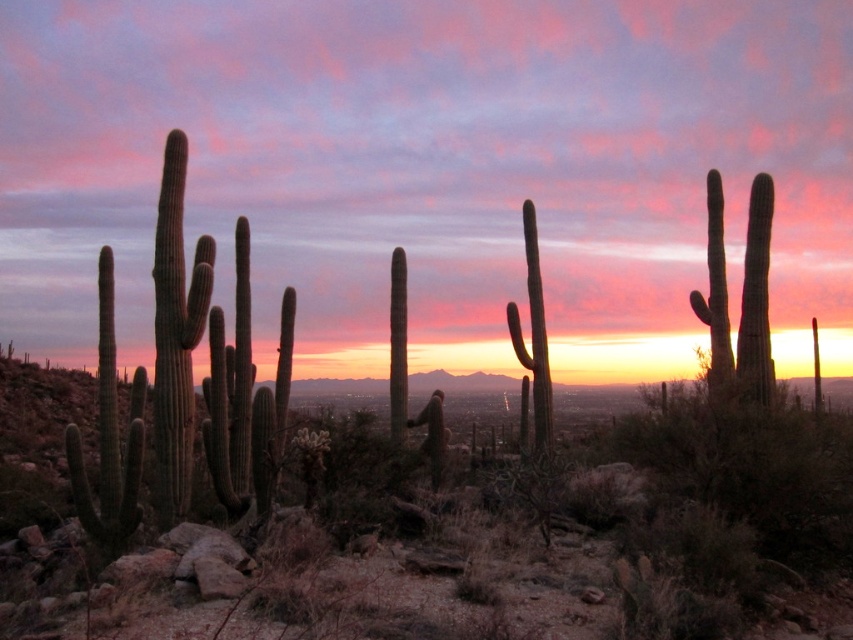
Question: Can you confirm if green spiny cactus at left is positioned to the left of green spiny cactus at center?

Choices:
 (A) no
 (B) yes

Answer: (B)

Question: Considering the relative positions of green spiny cactus at left and green spiny cactus at center in the image provided, where is green spiny cactus at left located with respect to green spiny cactus at center?

Choices:
 (A) above
 (B) below

Answer: (A)

Question: Which of the following is the closest to the observer?

Choices:
 (A) (549, 435)
 (B) (236, 512)

Answer: (B)

Question: Which point is closer to the camera?

Choices:
 (A) (543, 307)
 (B) (166, 445)

Answer: (B)

Question: Does green spiny cactus at left have a smaller size compared to green spiny cactus at center?

Choices:
 (A) yes
 (B) no

Answer: (B)